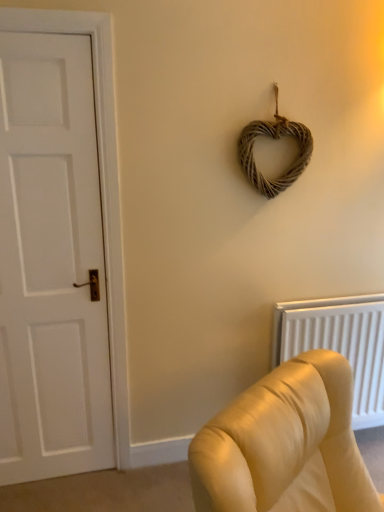
Question: Considering the relative sizes of white matte door at left and woven natural heart at upper center in the image provided, is white matte door at left thinner than woven natural heart at upper center?

Choices:
 (A) yes
 (B) no

Answer: (B)

Question: From a real-world perspective, does white matte door at left stand above woven natural heart at upper center?

Choices:
 (A) no
 (B) yes

Answer: (A)

Question: From a real-world perspective, is white matte door at left beneath woven natural heart at upper center?

Choices:
 (A) no
 (B) yes

Answer: (B)

Question: Is white matte door at left taller than woven natural heart at upper center?

Choices:
 (A) yes
 (B) no

Answer: (A)

Question: From the image's perspective, is white matte door at left on woven natural heart at upper center?

Choices:
 (A) no
 (B) yes

Answer: (A)

Question: Is white matte door at left wider or thinner than white textured radiator at lower right?

Choices:
 (A) thin
 (B) wide

Answer: (A)

Question: Based on their sizes in the image, would you say white matte door at left is bigger or smaller than white textured radiator at lower right?

Choices:
 (A) big
 (B) small

Answer: (A)

Question: Relative to white textured radiator at lower right, is white matte door at left in front or behind?

Choices:
 (A) front
 (B) behind

Answer: (A)

Question: From the image's perspective, is white matte door at left positioned above or below white textured radiator at lower right?

Choices:
 (A) above
 (B) below

Answer: (A)

Question: From the image's perspective, is woven natural heart at upper center positioned above or below white matte door at left?

Choices:
 (A) above
 (B) below

Answer: (A)

Question: From a real-world perspective, is woven natural heart at upper center positioned above or below white matte door at left?

Choices:
 (A) below
 (B) above

Answer: (B)

Question: Is point (291, 174) positioned closer to the camera than point (16, 64)?

Choices:
 (A) closer
 (B) farther

Answer: (B)

Question: Considering the positions of woven natural heart at upper center and white matte door at left in the image, is woven natural heart at upper center wider or thinner than white matte door at left?

Choices:
 (A) wide
 (B) thin

Answer: (B)

Question: From a real-world perspective, relative to woven natural heart at upper center, is white textured radiator at lower right vertically above or below?

Choices:
 (A) below
 (B) above

Answer: (A)

Question: From the image's perspective, is white textured radiator at lower right positioned above or below woven natural heart at upper center?

Choices:
 (A) below
 (B) above

Answer: (A)